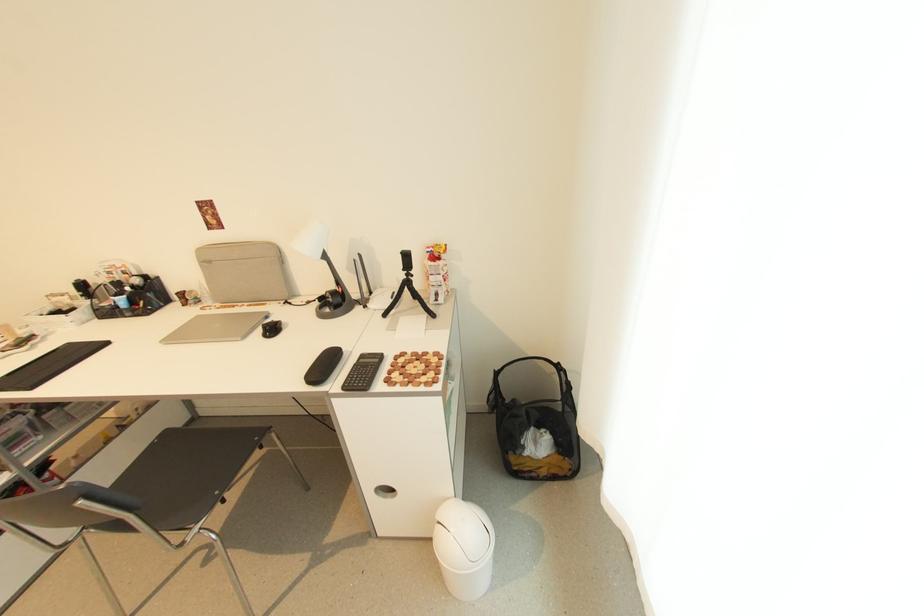
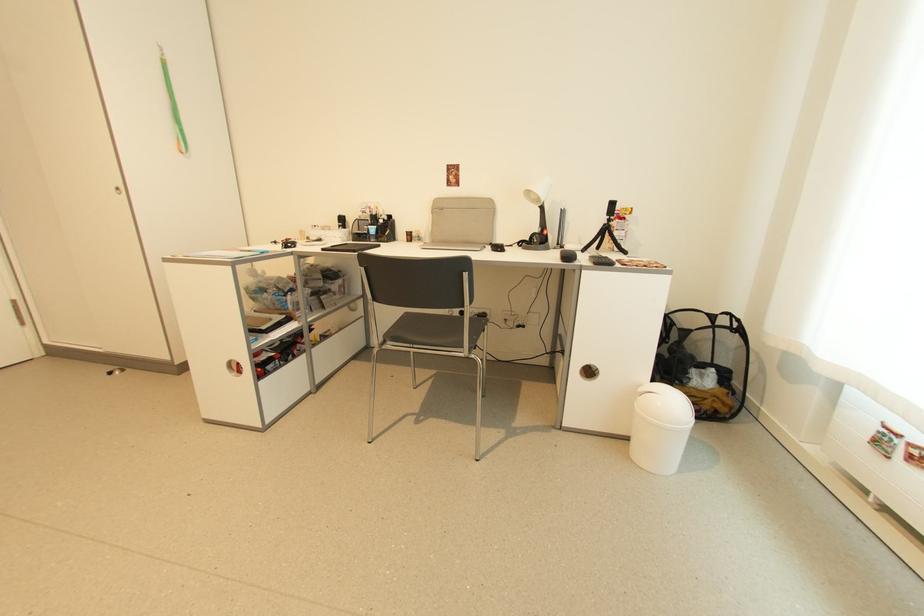
Question: The first image is from the beginning of the video and the second image is from the end. How did the camera likely rotate when shooting the video?

Choices:
 (A) Left
 (B) Right
 (C) Up
 (D) Down

Answer: (C)